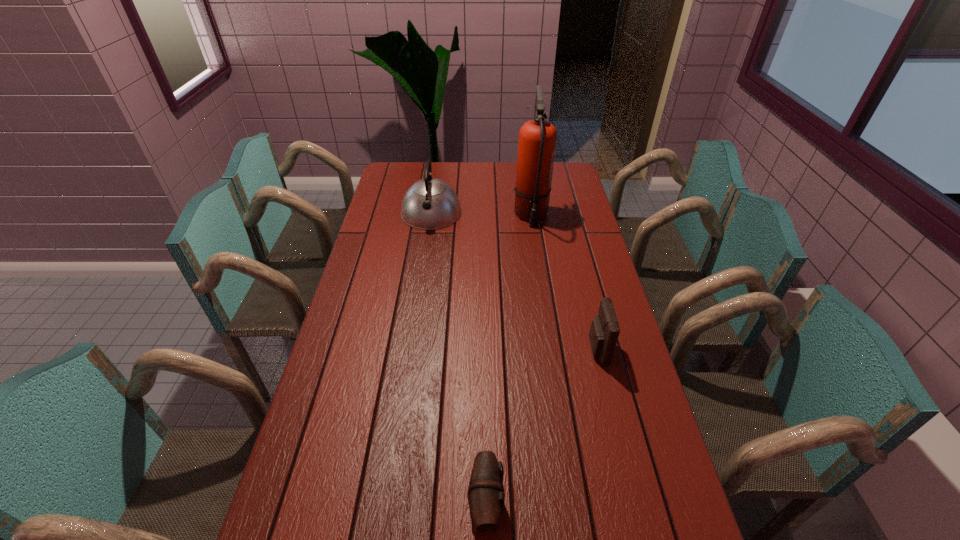
Where is `vacant space located with an open flap on the farther pouch`? The width and height of the screenshot is (960, 540). vacant space located with an open flap on the farther pouch is located at coordinates (466, 349).

This screenshot has width=960, height=540. Identify the location of object that is at the left edge. (430, 203).

Find the location of `fire extinguisher at the right edge`. fire extinguisher at the right edge is located at coordinates (537, 138).

You are a GUI agent. You are given a task and a screenshot of the screen. Output one action in this format:
    pyautogui.click(x=<x>, y=<y>)
    Task: Click on the pouch that is at the right edge
    This screenshot has height=540, width=960.
    Given the screenshot: What is the action you would take?
    pyautogui.click(x=604, y=331)

Locate an element on the screen. Image resolution: width=960 pixels, height=540 pixels. free space at the far edge is located at coordinates (510, 170).

At what (x,y) coordinates should I click in order to perform the action: click on free space at the left edge of the desktop. Please return your answer as a coordinate pair (x, y). Looking at the image, I should click on point(348,413).

This screenshot has height=540, width=960. Identify the location of free location at the right edge. (601, 262).

I want to click on vacant region at the far right corner of the desktop, so click(x=566, y=170).

Where is `free spot between the third farthest object and the tallest object`? The height and width of the screenshot is (540, 960). free spot between the third farthest object and the tallest object is located at coordinates (564, 282).

The height and width of the screenshot is (540, 960). Identify the location of vacant point located between the farther pouch and the second tallest object. (515, 281).